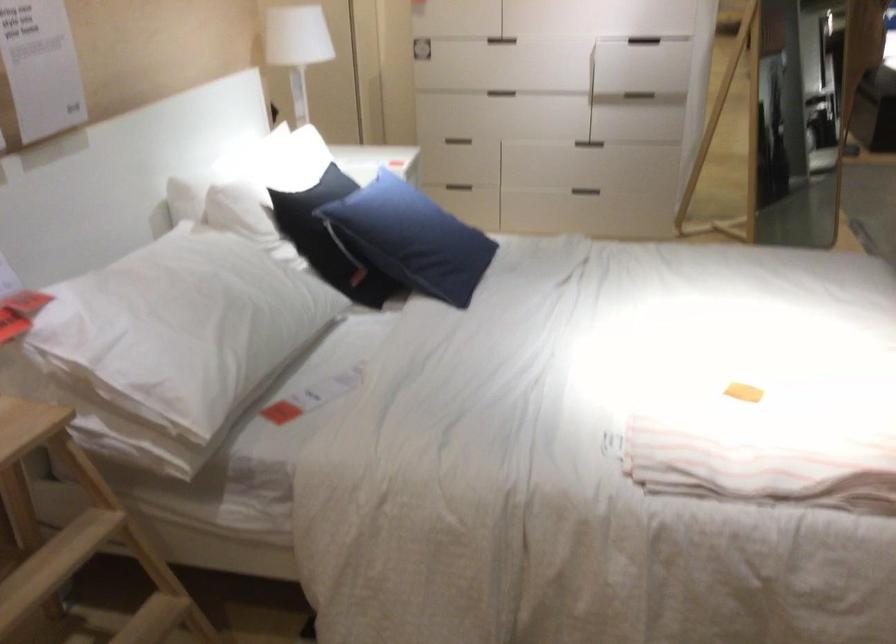
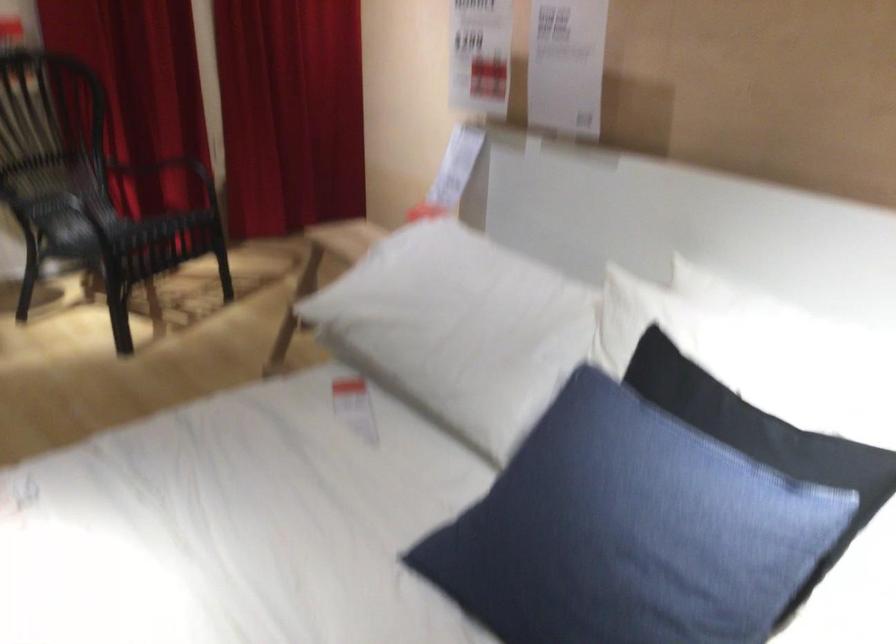
Locate, in the second image, the point that corresponds to [433,214] in the first image.

(644, 536)